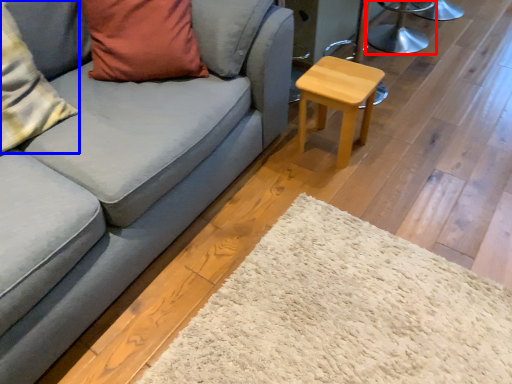
Question: Among these objects, which one is farthest to the camera, swivel chair (highlighted by a red box) or pillow (highlighted by a blue box)?

Choices:
 (A) swivel chair
 (B) pillow

Answer: (A)